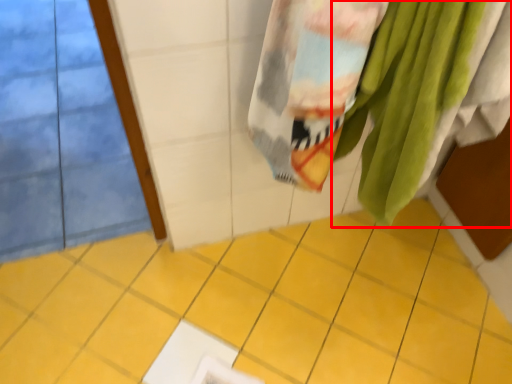
Question: Observing the image, what is the correct spatial positioning of towel (annotated by the red box) in reference to ceramic tile?

Choices:
 (A) right
 (B) left

Answer: (A)